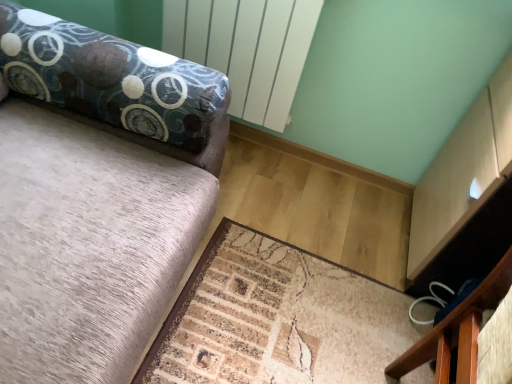
Question: Considering their positions, is beige textured mat at lower center located in front of or behind black fabric drawer at lower right?

Choices:
 (A) front
 (B) behind

Answer: (A)

Question: Is beige textured mat at lower center taller or shorter than black fabric drawer at lower right?

Choices:
 (A) short
 (B) tall

Answer: (A)

Question: Is point (270, 296) positioned closer to the camera than point (401, 355)?

Choices:
 (A) closer
 (B) farther

Answer: (B)

Question: Looking at their shapes, would you say black fabric drawer at lower right is wider or thinner than beige textured mat at lower center?

Choices:
 (A) thin
 (B) wide

Answer: (A)

Question: Considering the positions of point (474, 292) and point (355, 380), is point (474, 292) closer or farther from the camera than point (355, 380)?

Choices:
 (A) closer
 (B) farther

Answer: (A)

Question: Would you say black fabric drawer at lower right is to the left or to the right of beige textured mat at lower center in the picture?

Choices:
 (A) right
 (B) left

Answer: (A)

Question: From a real-world perspective, is black fabric drawer at lower right above or below beige textured mat at lower center?

Choices:
 (A) below
 (B) above

Answer: (B)